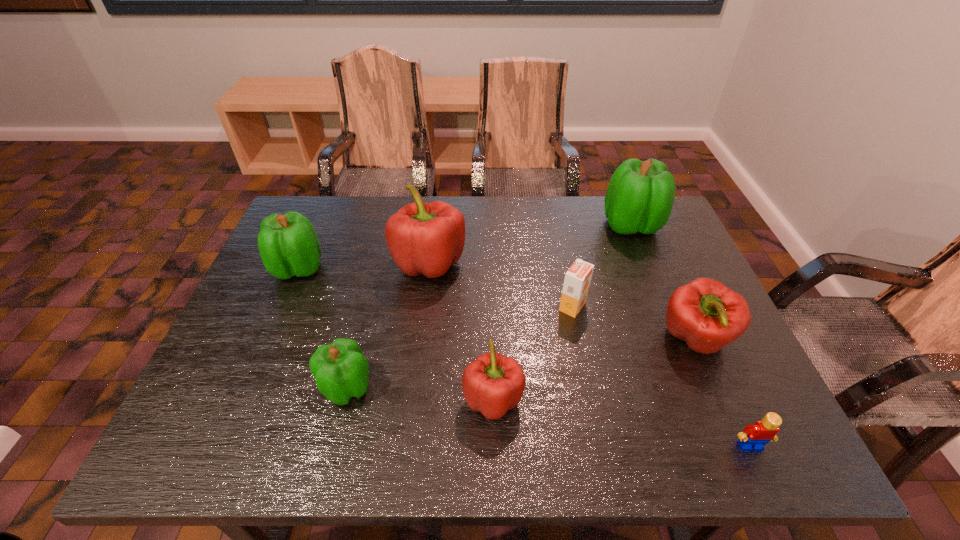
I want to click on the rightmost green bell pepper, so click(639, 198).

Locate an element on the screen. This screenshot has width=960, height=540. the biggest green bell pepper is located at coordinates (639, 198).

The image size is (960, 540). In order to click on the leftmost pink bell pepper in this screenshot , I will do `click(423, 238)`.

I want to click on the biggest pink bell pepper, so click(x=423, y=238).

Find the location of a particular element. Image resolution: width=960 pixels, height=540 pixels. the leftmost green bell pepper is located at coordinates (288, 244).

This screenshot has height=540, width=960. What are the coordinates of `the second smallest green bell pepper` in the screenshot? It's located at (288, 244).

Find the location of a particular element. The width and height of the screenshot is (960, 540). the rightmost pink bell pepper is located at coordinates (707, 315).

The image size is (960, 540). I want to click on the second nearest pink bell pepper, so click(x=707, y=315).

In order to click on the fifth object from left to right in this screenshot , I will do coord(577,280).

This screenshot has width=960, height=540. Find the location of `orange juice`. orange juice is located at coordinates (577, 280).